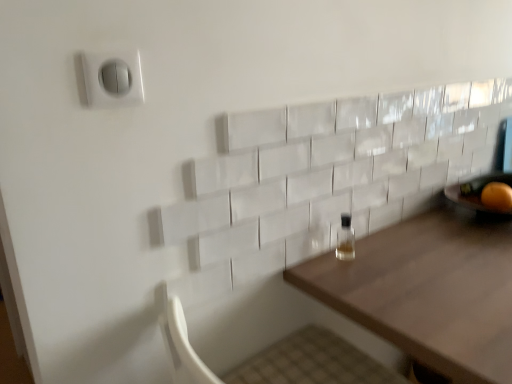
Question: Does orange matte at right have a greater width compared to wooden table at center?

Choices:
 (A) yes
 (B) no

Answer: (B)

Question: Considering the relative sizes of orange matte at right and wooden table at center in the image provided, is orange matte at right thinner than wooden table at center?

Choices:
 (A) no
 (B) yes

Answer: (B)

Question: Is orange matte at right far from wooden table at center?

Choices:
 (A) no
 (B) yes

Answer: (A)

Question: Would you say orange matte at right contains wooden table at center?

Choices:
 (A) no
 (B) yes

Answer: (A)

Question: From a real-world perspective, is orange matte at right on top of wooden table at center?

Choices:
 (A) yes
 (B) no

Answer: (A)

Question: Can you confirm if orange matte at right is bigger than wooden table at center?

Choices:
 (A) no
 (B) yes

Answer: (A)

Question: From a real-world perspective, is orange matte at right physically above white plastic switch at upper left?

Choices:
 (A) no
 (B) yes

Answer: (A)

Question: Is orange matte at right not within white plastic switch at upper left?

Choices:
 (A) no
 (B) yes

Answer: (B)

Question: Does orange matte at right appear on the left side of white plastic switch at upper left?

Choices:
 (A) yes
 (B) no

Answer: (B)

Question: Is orange matte at right bigger than white plastic switch at upper left?

Choices:
 (A) no
 (B) yes

Answer: (B)

Question: Does orange matte at right appear on the right side of white plastic switch at upper left?

Choices:
 (A) yes
 (B) no

Answer: (A)

Question: From the image's perspective, is orange matte at right located above white plastic switch at upper left?

Choices:
 (A) no
 (B) yes

Answer: (A)

Question: Does wooden table at center have a greater height compared to orange matte at right?

Choices:
 (A) yes
 (B) no

Answer: (A)